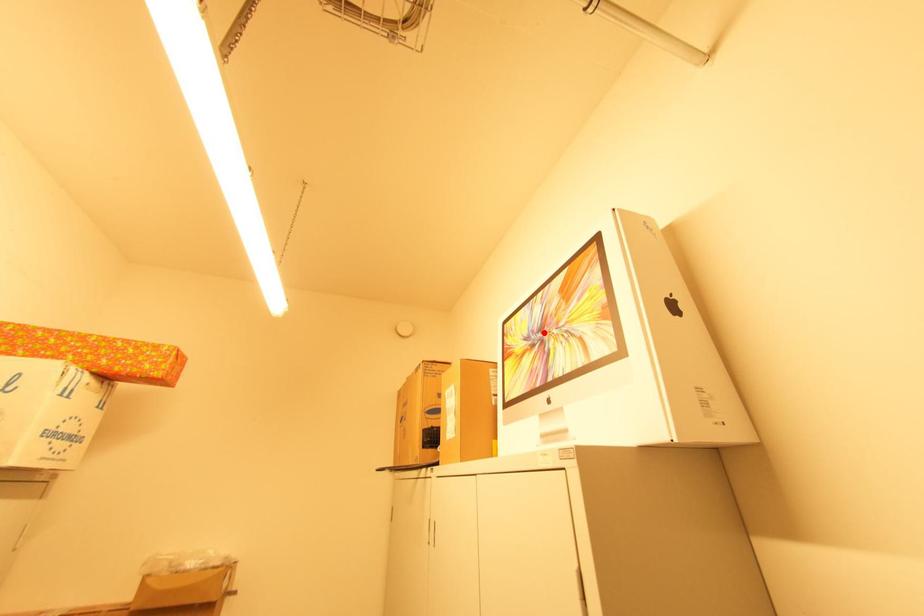
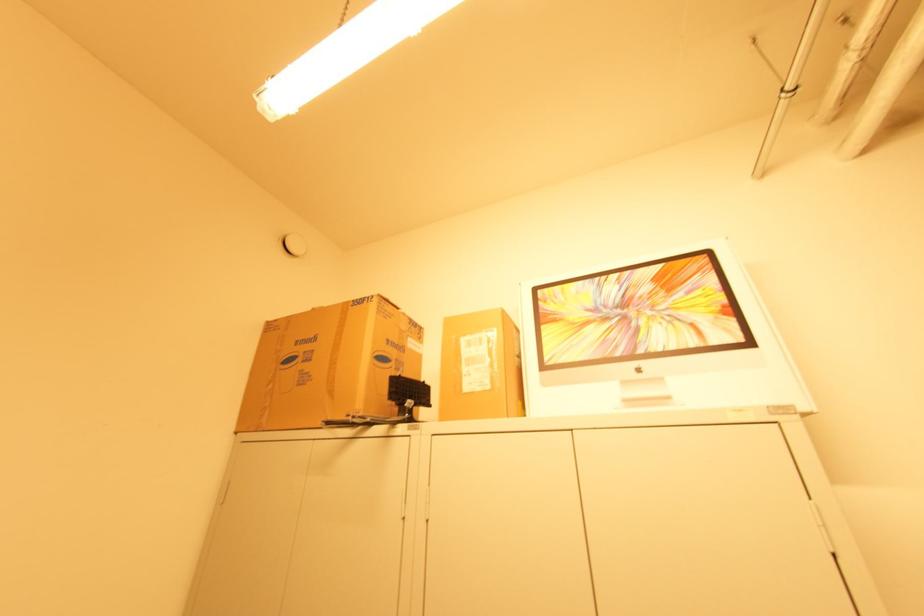
Where in the second image is the point corresponding to the highlighted location from the first image?

(625, 310)